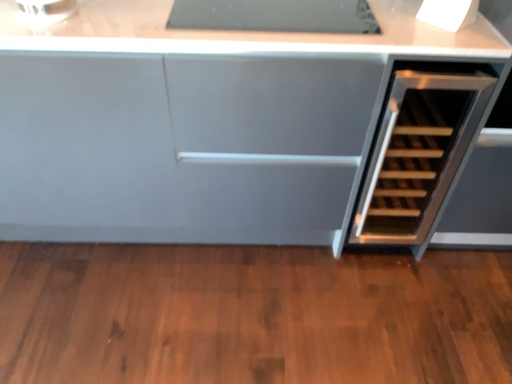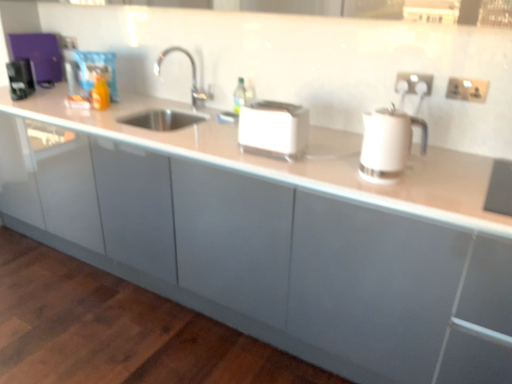
Question: How did the camera likely rotate when shooting the video?

Choices:
 (A) rotated downward
 (B) rotated upward

Answer: (B)